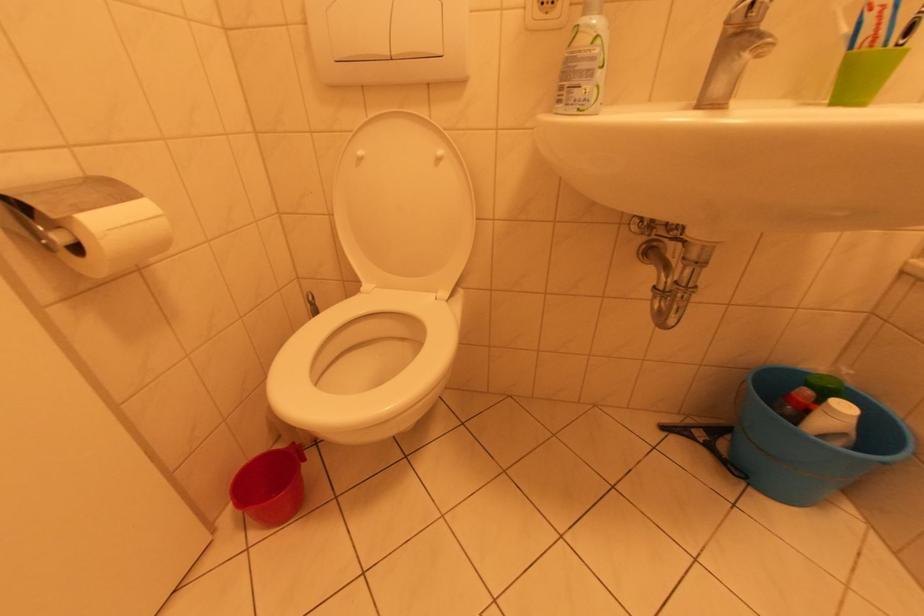
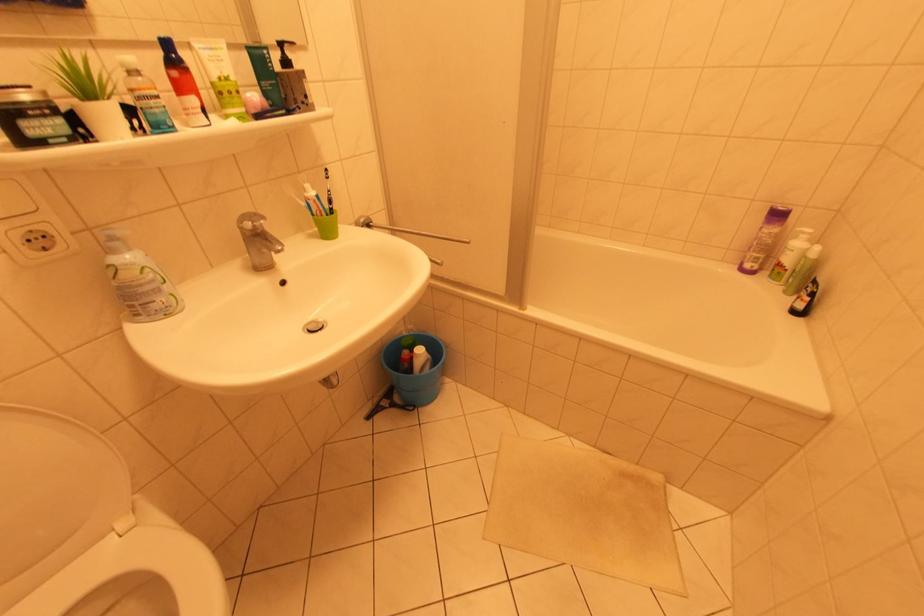
How did the camera likely rotate?

The camera's rotation is toward right-down.